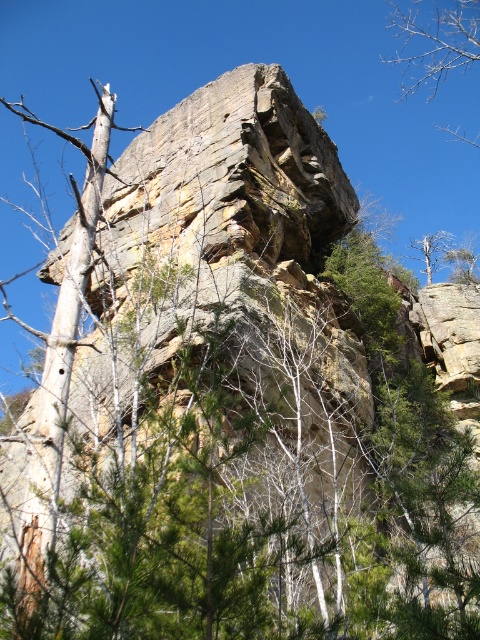
You are an environmental scientist observing the cliff. You notice the bare branches at upper right and the dead wood tree at upper right. Which of these two has a greater height?

The bare branches at upper right has a greater height compared to the dead wood tree at upper right according to the description.

You are a bird seeking a nesting spot. You notice the bare branches at upper right in the image. Based on their position, can you determine if they are suitable for building a nest?

The bare branches at upper right are located at coordinates point (434, 44), which places them near the upper part of the image. This position might be suitable for a nest as it provides elevation and visibility, but you should also consider the stability of the branches themselves.

You are an ornithologist studying bird habitats in the area. You notice a spot marked by coordinates point (434,44) where there are bare branches. Based on the scene description, what type of tree might you expect to find there?

The point (434,44) indicates bare branches at upper right, so you would expect to find deciduous trees there since they lose their leaves in autumn or winter, unlike the evergreen conifers which retain their foliage.